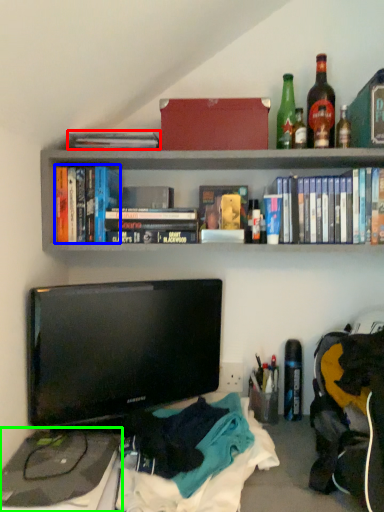
Question: Which object is the farthest from book (highlighted by a red box)? Choose among these: book (highlighted by a blue box) or desktop (highlighted by a green box).

Choices:
 (A) book
 (B) desktop

Answer: (B)